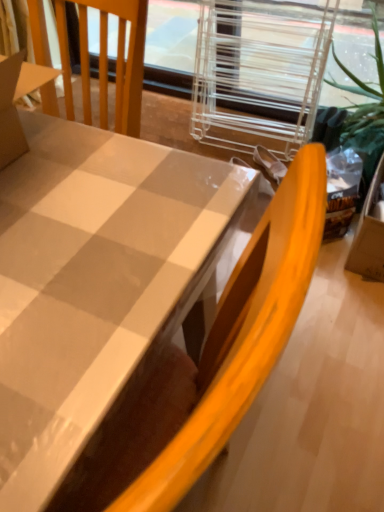
Question: Should I look upward or downward to see white glossy table at center?

Choices:
 (A) up
 (B) down

Answer: (B)